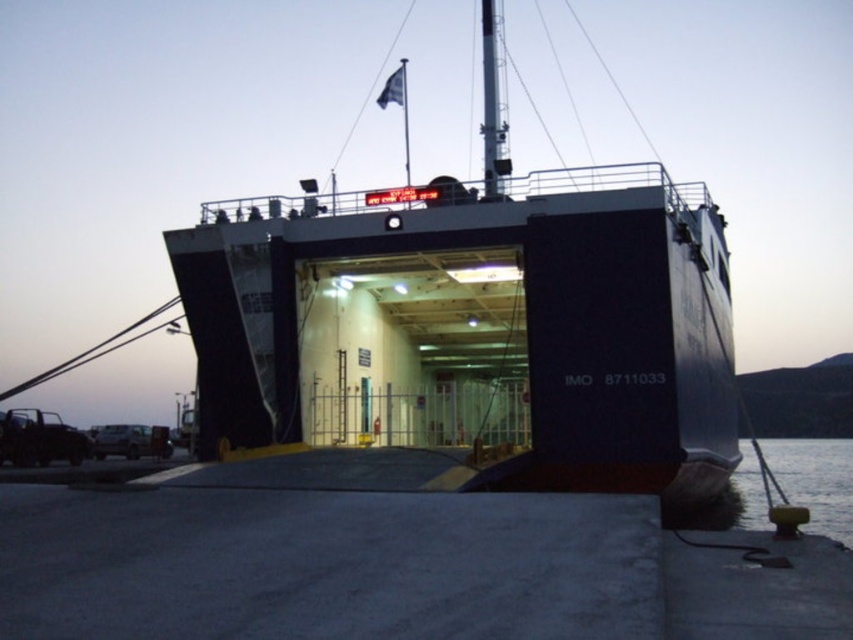
Between point (618, 355) and point (799, 481), which one is positioned in front?

Point (618, 355) is in front.

Between point (480, 182) and point (776, 442), which one is positioned behind?

Point (776, 442)

Locate an element on the screen. This screenshot has height=640, width=853. dark blue matte ship at center is located at coordinates (476, 317).